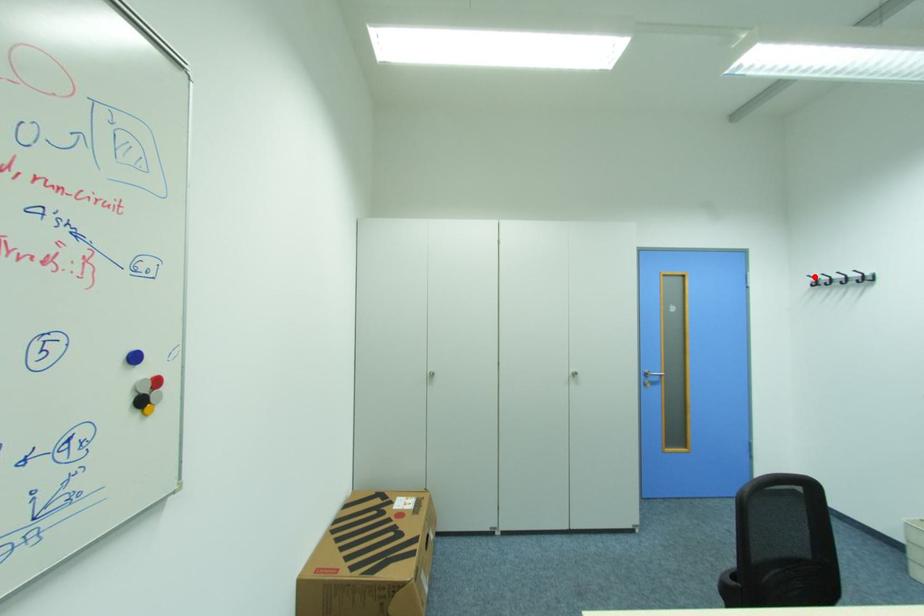
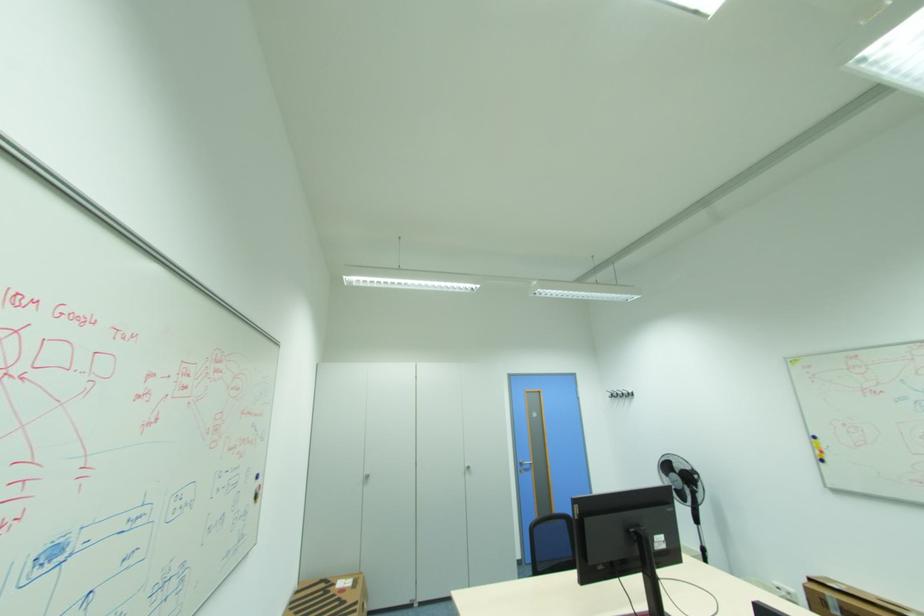
Where in the second image is the point corresponding to the highlighted location from the first image?

(613, 391)